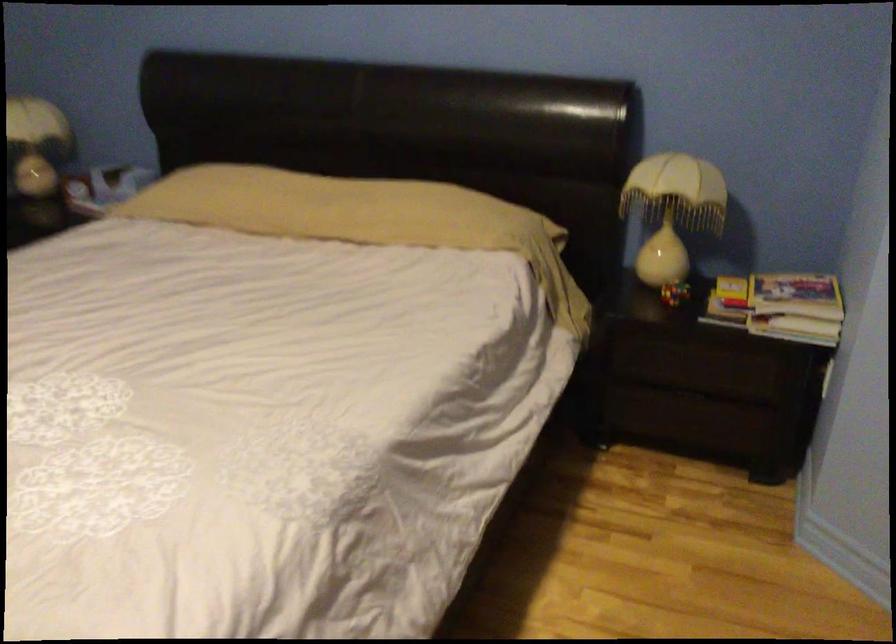
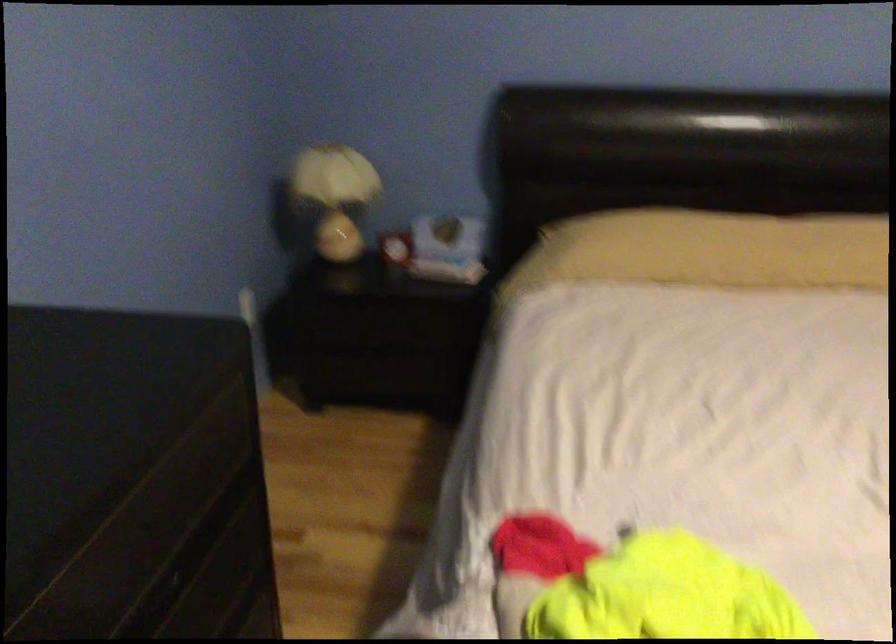
Question: Which direction would the cameraman need to move to produce the second image? Reply with the corresponding letter.

Choices:
 (A) Left
 (B) Right
 (C) Forward
 (D) Backward

Answer: (A)